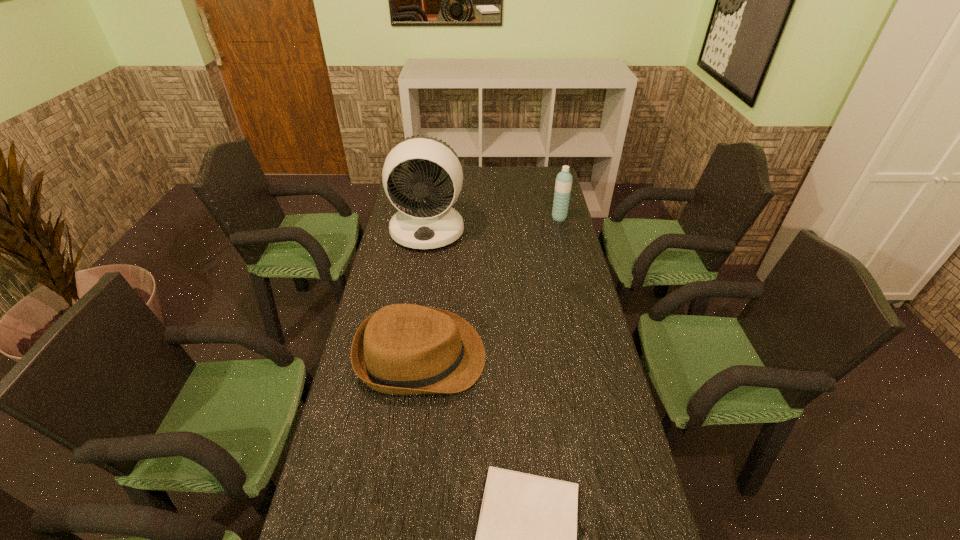
Where is `object that is positioned at the right edge`? This screenshot has height=540, width=960. object that is positioned at the right edge is located at coordinates (563, 185).

This screenshot has width=960, height=540. In the image, there is a desktop. Identify the location of vacant space at the far edge. (468, 169).

I want to click on vacant region at the left edge of the desktop, so click(x=369, y=399).

This screenshot has height=540, width=960. I want to click on free location at the right edge of the desktop, so click(x=557, y=392).

The width and height of the screenshot is (960, 540). Find the location of `vacant region at the far right corner`. vacant region at the far right corner is located at coordinates (544, 171).

At what (x,y) coordinates should I click in order to perform the action: click on free space between the water bottle and the third tallest object. Please return your answer as a coordinate pair (x, y). This screenshot has height=540, width=960. Looking at the image, I should click on (491, 287).

The image size is (960, 540). I want to click on unoccupied position between the tallest object and the third shortest object, so click(493, 224).

Identify the location of free space between the third shortest object and the tallest object. The image size is (960, 540). (493, 224).

Locate an element on the screen. Image resolution: width=960 pixels, height=540 pixels. free space between the tallest object and the rightmost object is located at coordinates (493, 224).

Choose which object is the third nearest neighbor to the rightmost object. Please provide its 2D coordinates. Your answer should be formatted as a tuple, i.e. [(x, y)], where the tuple contains the x and y coordinates of a point satisfying the conditions above.

[(526, 535)]